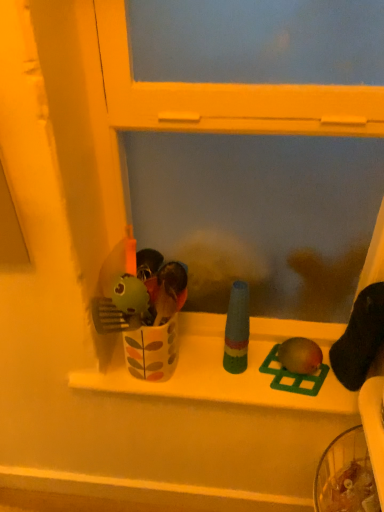
Where is `free space in front of multicolored plastic bottle at center, the first toy from the left`? free space in front of multicolored plastic bottle at center, the first toy from the left is located at coordinates (245, 388).